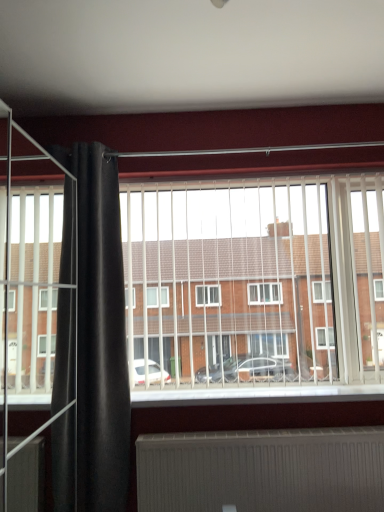
Question: Is white plastic blinds at center in front of black velvet curtain at left?

Choices:
 (A) yes
 (B) no

Answer: (B)

Question: Can you confirm if white plastic blinds at center is positioned to the left of black velvet curtain at left?

Choices:
 (A) no
 (B) yes

Answer: (A)

Question: Is white plastic blinds at center behind black velvet curtain at left?

Choices:
 (A) yes
 (B) no

Answer: (A)

Question: Considering the relative sizes of white plastic blinds at center and black velvet curtain at left in the image provided, is white plastic blinds at center bigger than black velvet curtain at left?

Choices:
 (A) yes
 (B) no

Answer: (A)

Question: From a real-world perspective, is white plastic blinds at center beneath black velvet curtain at left?

Choices:
 (A) yes
 (B) no

Answer: (B)

Question: Can you confirm if white plastic blinds at center is taller than black velvet curtain at left?

Choices:
 (A) no
 (B) yes

Answer: (A)

Question: Is white ribbed radiator at lower center surrounded by white plastic blinds at center?

Choices:
 (A) yes
 (B) no

Answer: (B)

Question: Is white plastic blinds at center far away from white ribbed radiator at lower center?

Choices:
 (A) yes
 (B) no

Answer: (B)

Question: Does white plastic blinds at center lie behind white ribbed radiator at lower center?

Choices:
 (A) yes
 (B) no

Answer: (A)

Question: Considering the relative sizes of white plastic blinds at center and white ribbed radiator at lower center in the image provided, is white plastic blinds at center taller than white ribbed radiator at lower center?

Choices:
 (A) yes
 (B) no

Answer: (A)

Question: Is white plastic blinds at center beside white ribbed radiator at lower center?

Choices:
 (A) yes
 (B) no

Answer: (B)

Question: Is white plastic blinds at center wider than white ribbed radiator at lower center?

Choices:
 (A) yes
 (B) no

Answer: (A)

Question: Does black velvet curtain at left have a greater height compared to white plastic blinds at center?

Choices:
 (A) yes
 (B) no

Answer: (A)